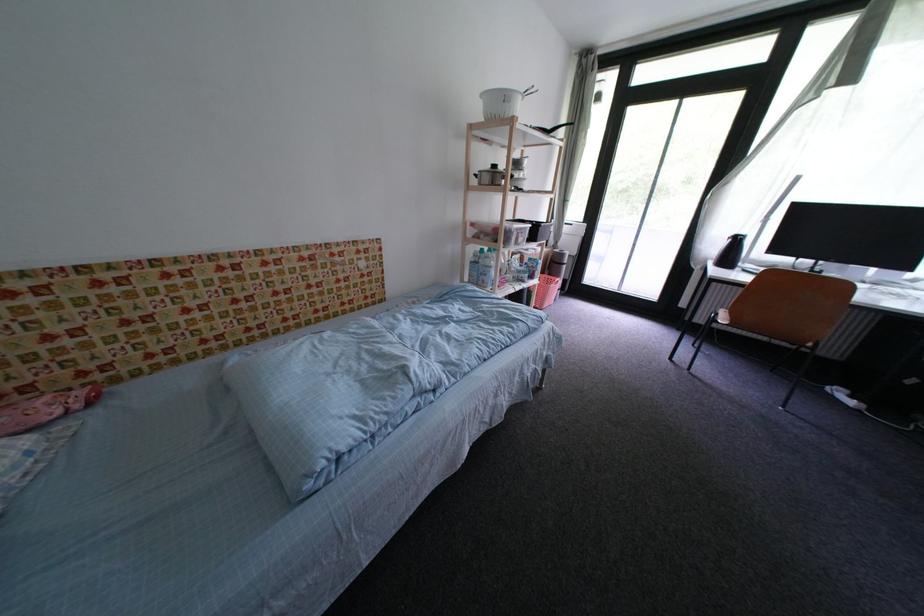
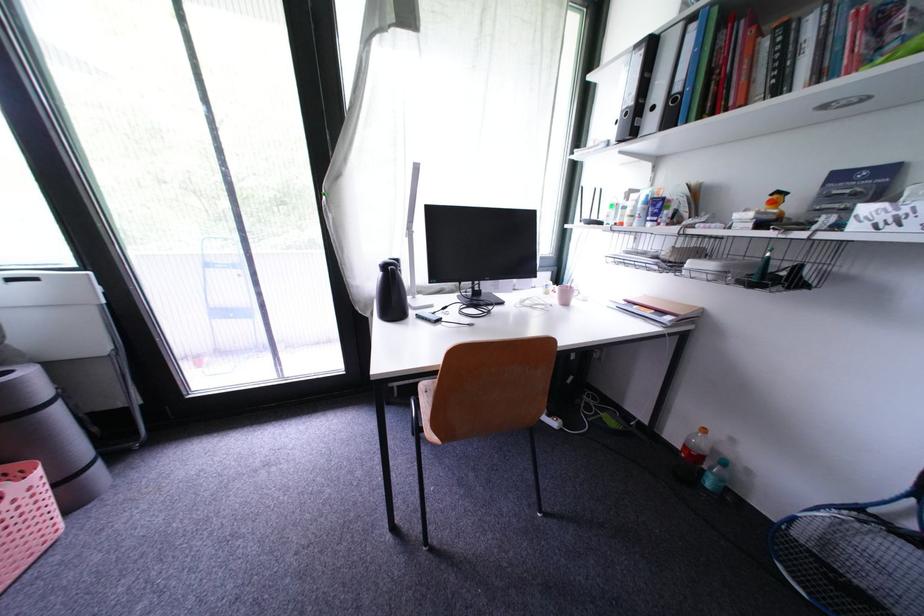
Find the pixel in the second image that matches (x=744, y=244) in the first image.

(398, 274)